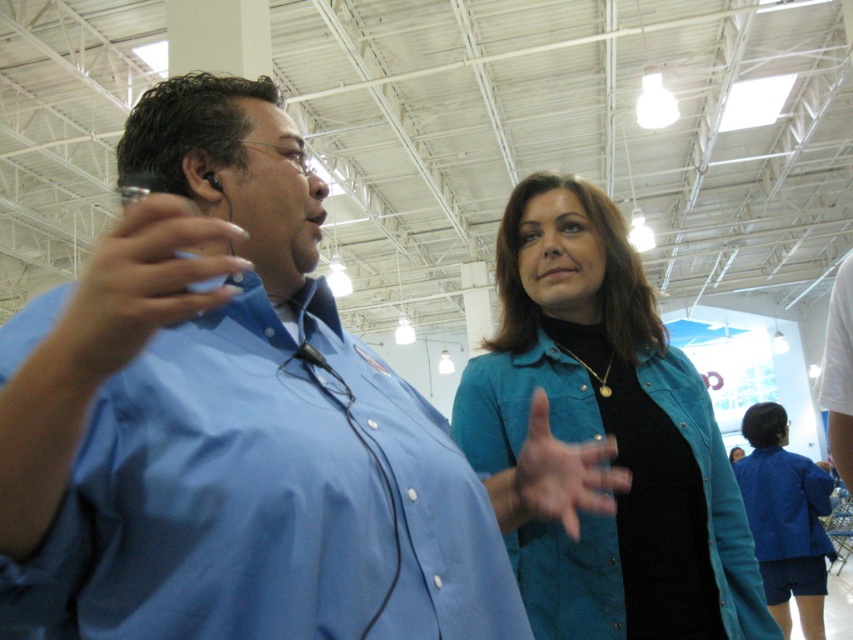
Based on the photo, between teal denim shirt at center and matte blue shirt at upper left, which one appears on the left side from the viewer's perspective?

matte blue shirt at upper left is more to the left.

Measure the distance between teal denim shirt at center and matte blue shirt at upper left.

teal denim shirt at center is 87.68 centimeters away from matte blue shirt at upper left.

I want to click on teal denim shirt at center, so click(x=607, y=433).

Between teal denim shirt at center and blue denim jacket at lower right, which one has less height?

Standing shorter between the two is teal denim shirt at center.

Who is more distant from viewer, (x=556, y=576) or (x=798, y=568)?

Positioned behind is point (x=798, y=568).

The image size is (853, 640). I want to click on teal denim shirt at center, so click(x=607, y=433).

Between matte blue shirt at upper left and blue denim jacket at lower right, which one has less height?

Standing shorter between the two is matte blue shirt at upper left.

Can you confirm if matte blue shirt at upper left is smaller than blue denim jacket at lower right?

Indeed, matte blue shirt at upper left has a smaller size compared to blue denim jacket at lower right.

Is point (57, 358) positioned before point (769, 451)?

Yes, it is in front of point (769, 451).

Find the location of `matte blue shirt at upper left`. matte blue shirt at upper left is located at coordinates (138, 285).